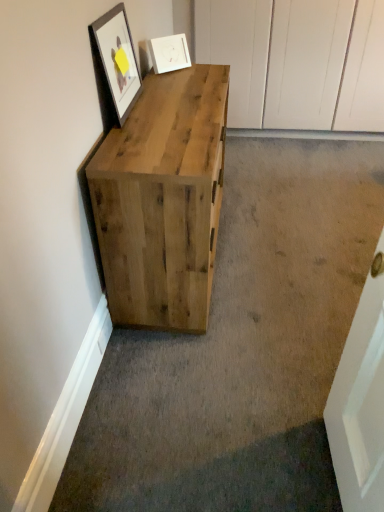
Question: Does natural wood chest of drawers at left appear on the left side of white matte picture frame at upper center, arranged as the second picture frame when viewed from the left?

Choices:
 (A) yes
 (B) no

Answer: (B)

Question: Would you say natural wood chest of drawers at left is outside white matte picture frame at upper center, which ranks as the 1th picture frame in right-to-left order?

Choices:
 (A) no
 (B) yes

Answer: (B)

Question: Is natural wood chest of drawers at left further to the viewer compared to white matte picture frame at upper center, the second picture frame when ordered from front to back?

Choices:
 (A) yes
 (B) no

Answer: (B)

Question: Could white matte picture frame at upper center, the second picture frame when ordered from front to back, be considered to be inside natural wood chest of drawers at left?

Choices:
 (A) yes
 (B) no

Answer: (B)

Question: From the image's perspective, is natural wood chest of drawers at left on top of white matte picture frame at upper center, arranged as the second picture frame when viewed from the left?

Choices:
 (A) no
 (B) yes

Answer: (A)

Question: From their relative heights in the image, would you say natural wood chest of drawers at left is taller or shorter than white matte picture frame at upper center, acting as the first picture frame starting from the back?

Choices:
 (A) tall
 (B) short

Answer: (A)

Question: Considering the positions of point (124, 157) and point (188, 61), is point (124, 157) closer or farther from the camera than point (188, 61)?

Choices:
 (A) closer
 (B) farther

Answer: (A)

Question: In terms of width, does natural wood chest of drawers at left look wider or thinner when compared to white matte picture frame at upper center, acting as the first picture frame starting from the back?

Choices:
 (A) wide
 (B) thin

Answer: (A)

Question: Based on their sizes in the image, would you say natural wood chest of drawers at left is bigger or smaller than white matte picture frame at upper center, which ranks as the 1th picture frame in right-to-left order?

Choices:
 (A) small
 (B) big

Answer: (B)

Question: Is point (107, 86) closer or farther from the camera than point (185, 59)?

Choices:
 (A) closer
 (B) farther

Answer: (A)

Question: Looking at their shapes, would you say matte black frame at upper left, which is counted as the first picture frame, starting from the front, is wider or thinner than white matte picture frame at upper center, the second picture frame when ordered from front to back?

Choices:
 (A) thin
 (B) wide

Answer: (A)

Question: Would you say matte black frame at upper left, which ranks as the 2th picture frame in right-to-left order, is inside or outside white matte picture frame at upper center, acting as the first picture frame starting from the back?

Choices:
 (A) inside
 (B) outside

Answer: (B)

Question: In terms of height, does matte black frame at upper left, which ranks as the 2th picture frame in back-to-front order, look taller or shorter compared to white matte picture frame at upper center, arranged as the second picture frame when viewed from the left?

Choices:
 (A) short
 (B) tall

Answer: (B)

Question: Does point (110, 253) appear closer or farther from the camera than point (139, 77)?

Choices:
 (A) farther
 (B) closer

Answer: (B)

Question: Considering the positions of natural wood chest of drawers at left and matte black frame at upper left, which ranks as the 2th picture frame in back-to-front order, in the image, is natural wood chest of drawers at left bigger or smaller than matte black frame at upper left, which ranks as the 2th picture frame in back-to-front order,?

Choices:
 (A) small
 (B) big

Answer: (B)